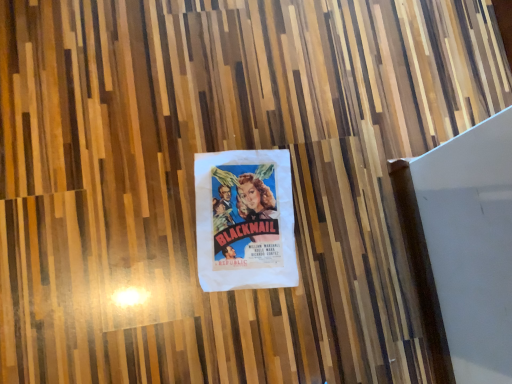
At what (x,y) coordinates should I click in order to perform the action: click on vacant area on top of white paper poster at center (from a real-world perspective). Please return your answer as a coordinate pair (x, y). The image size is (512, 384). Looking at the image, I should click on (245, 221).